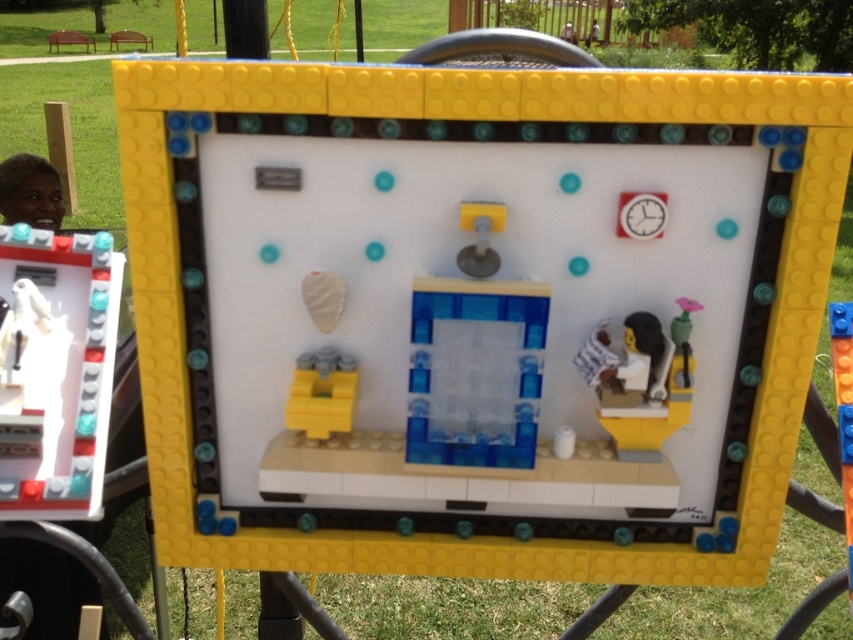
Can you confirm if yellow plastic bricks at lower left is wider than matte black face at upper left?

In fact, yellow plastic bricks at lower left might be narrower than matte black face at upper left.

Does point (325, 362) come in front of point (32, 184)?

Yes, it is in front of point (32, 184).

I want to click on yellow plastic bricks at lower left, so click(322, 392).

Which of these two, white glossy statue at left or smooth plastic figure at right, stands shorter?

With less height is smooth plastic figure at right.

Is white glossy statue at left shorter than smooth plastic figure at right?

In fact, white glossy statue at left may be taller than smooth plastic figure at right.

Where is `white glossy statue at left`? The image size is (853, 640). white glossy statue at left is located at coordinates (55, 371).

Is matte black face at upper left above smooth plastic figure at right?

Yes, matte black face at upper left is above smooth plastic figure at right.

Can you confirm if matte black face at upper left is taller than smooth plastic figure at right?

Yes, matte black face at upper left is taller than smooth plastic figure at right.

Between point (30, 224) and point (675, 323), which one is positioned behind?

The point (30, 224) is more distant.

Find the location of a particular element. The height and width of the screenshot is (640, 853). matte black face at upper left is located at coordinates (30, 192).